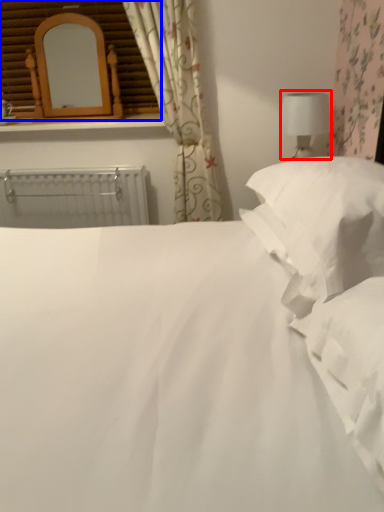
Question: Among these objects, which one is nearest to the camera, table lamp (highlighted by a red box) or window frame (highlighted by a blue box)?

Choices:
 (A) table lamp
 (B) window frame

Answer: (A)